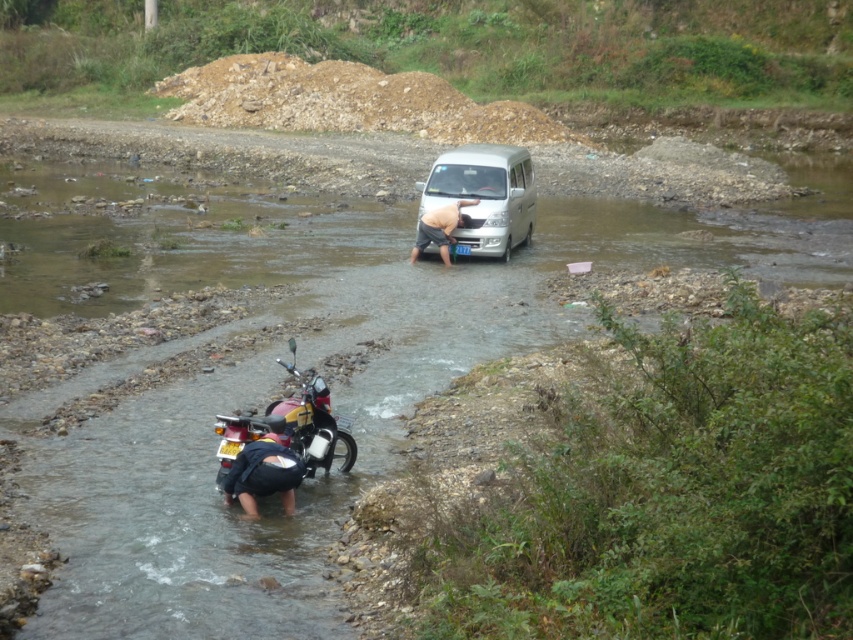
Question: Which point is farther to the camera?

Choices:
 (A) white matte van at center
 (B) dark blue fabric pants at lower left

Answer: (A)

Question: Is metallic red motorcycle at lower left below skinny man at center?

Choices:
 (A) no
 (B) yes

Answer: (B)

Question: Which of these objects is positioned farthest from the white matte van at center?

Choices:
 (A) dark blue fabric pants at lower left
 (B) skinny man at center

Answer: (A)

Question: Is white matte van at center smaller than dark blue fabric pants at lower left?

Choices:
 (A) no
 (B) yes

Answer: (A)

Question: Among these objects, which one is farthest from the camera?

Choices:
 (A) skinny man at center
 (B) white matte van at center

Answer: (B)

Question: Does metallic red motorcycle at lower left appear on the right side of skinny man at center?

Choices:
 (A) yes
 (B) no

Answer: (B)